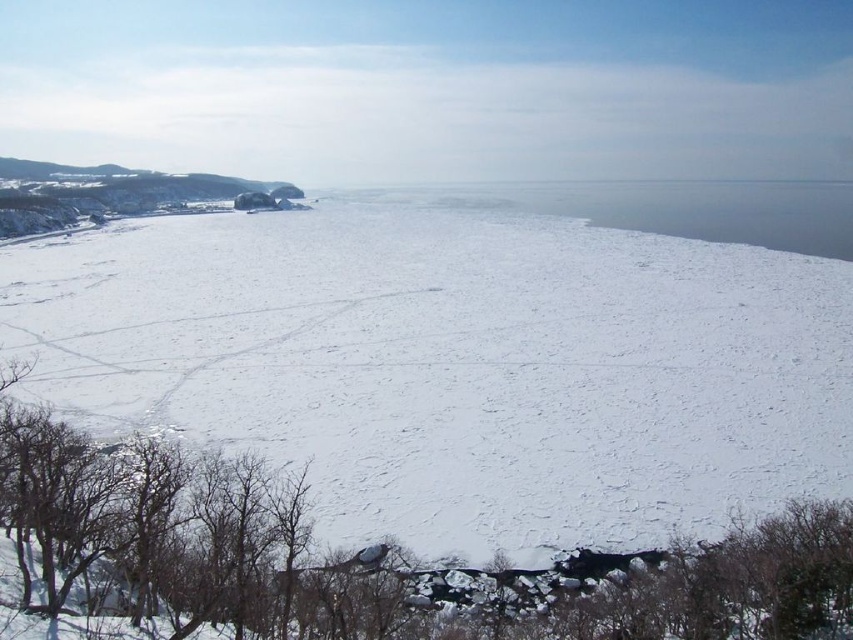
You are standing at the coordinates given in the image. You want to walk to the frozen lake edge. Which direction should you move to reach the frozen lake edge from your current position at white matte snow at center?

Based on the coordinates provided, moving north from white matte snow at center would lead you towards the frozen lake edge.

You are an ice fisherman planning to set up your equipment. You see white matte snow at center and transparent ice at center in the image. Which location would be more suitable for drilling a hole, and why?

The transparent ice at center is more suitable for drilling a hole because it indicates thinner ice, making it easier to drill through compared to the white matte snow at center which is likely on solid ground.

You are an ice skater standing on the frozen lake. You notice the white matte snow at center and the transparent ice at center. Which surface would allow you to glide more smoothly, and why?

The transparent ice at center would allow you to glide more smoothly because it is taller than the white matte snow at center, indicating it is a solid ice surface suitable for skating, while the snow might be softer and less stable.